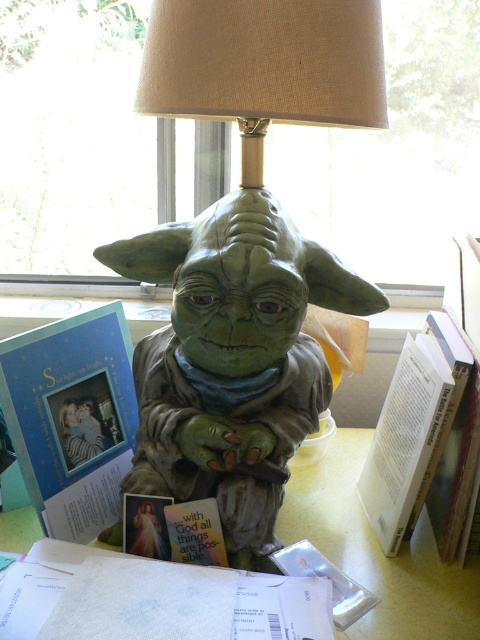
Is green matte yoda statue at center thinner than beige fabric lampshade at upper center?

No.

Between green matte yoda statue at center and beige fabric lampshade at upper center, which one has more height?

With more height is green matte yoda statue at center.

Is point (266, 456) positioned before point (208, 70)?

No, it is behind (208, 70).

What are the coordinates of `green matte yoda statue at center` in the screenshot? It's located at (231, 356).

Is matte blue card at left wider than white textured paper at lower center?

In fact, matte blue card at left might be narrower than white textured paper at lower center.

In the scene shown: Does matte blue card at left have a larger size compared to white textured paper at lower center?

Yes.

Find the location of a particular element. The height and width of the screenshot is (640, 480). matte blue card at left is located at coordinates (72, 417).

Can you confirm if beige fabric lampshade at upper center is positioned to the left of matte blue card at left?

In fact, beige fabric lampshade at upper center is to the right of matte blue card at left.

Does beige fabric lampshade at upper center appear over matte blue card at left?

Yes, beige fabric lampshade at upper center is above matte blue card at left.

Is point (255, 163) positioned after point (69, 387)?

No.

This screenshot has width=480, height=640. What are the coordinates of `beige fabric lampshade at upper center` in the screenshot? It's located at (264, 67).